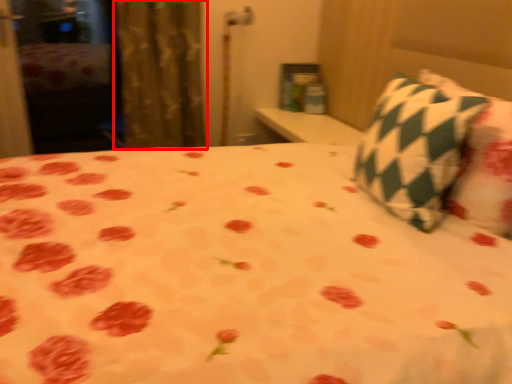
Question: From the image's perspective, considering the relative positions of curtain (annotated by the red box) and pillow in the image provided, where is curtain (annotated by the red box) located with respect to the staircase?

Choices:
 (A) below
 (B) above

Answer: (B)